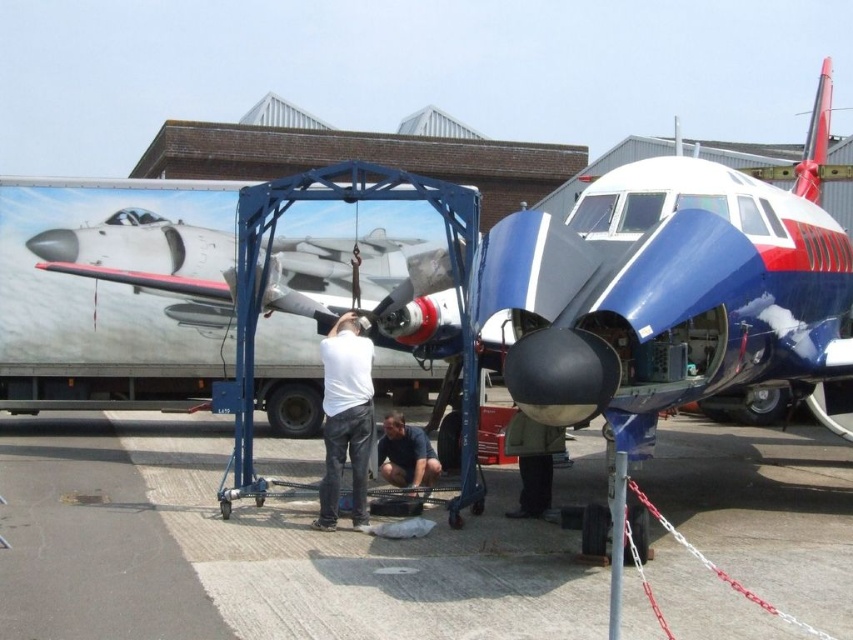
Question: Can you confirm if dark green jacket at center is thinner than dark blue jeans at lower center?

Choices:
 (A) no
 (B) yes

Answer: (B)

Question: Which object is the closest to the gray asphalt at center?

Choices:
 (A) white matte shirt at center
 (B) dark blue jeans at lower center

Answer: (A)

Question: Which object is the closest to the white matte shirt at center?

Choices:
 (A) dark green jacket at center
 (B) dark blue jeans at lower center

Answer: (B)

Question: Which point is closer to the camera taking this photo?

Choices:
 (A) (527, 442)
 (B) (598, 477)
 (C) (335, 358)
 (D) (416, 428)

Answer: (C)

Question: Does dark green jacket at center have a greater width compared to dark blue jeans at lower center?

Choices:
 (A) yes
 (B) no

Answer: (B)

Question: Does dark green jacket at center lie in front of dark blue jeans at lower center?

Choices:
 (A) no
 (B) yes

Answer: (B)